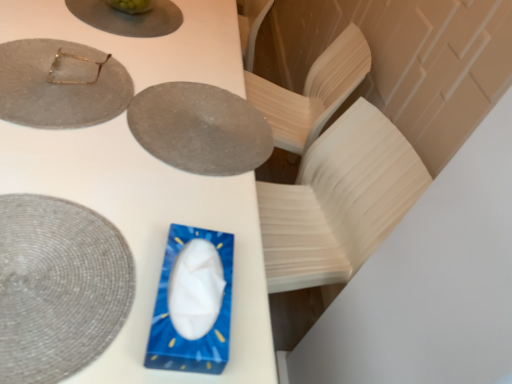
Locate an element on the screen. The width and height of the screenshot is (512, 384). empty space that is ontop of matte gray plate at upper center, the second plate positioned from the bottom is located at coordinates (201, 119).